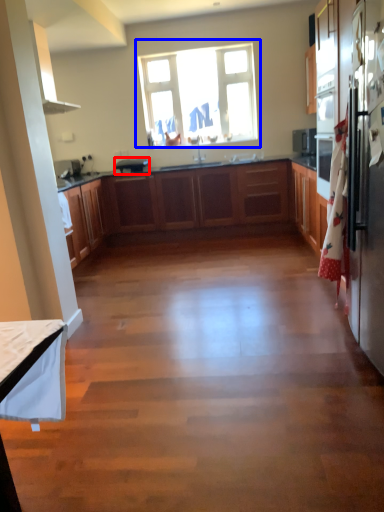
Question: Which of the following is the closest to the observer, appliance (highlighted by a red box) or window (highlighted by a blue box)?

Choices:
 (A) appliance
 (B) window

Answer: (A)